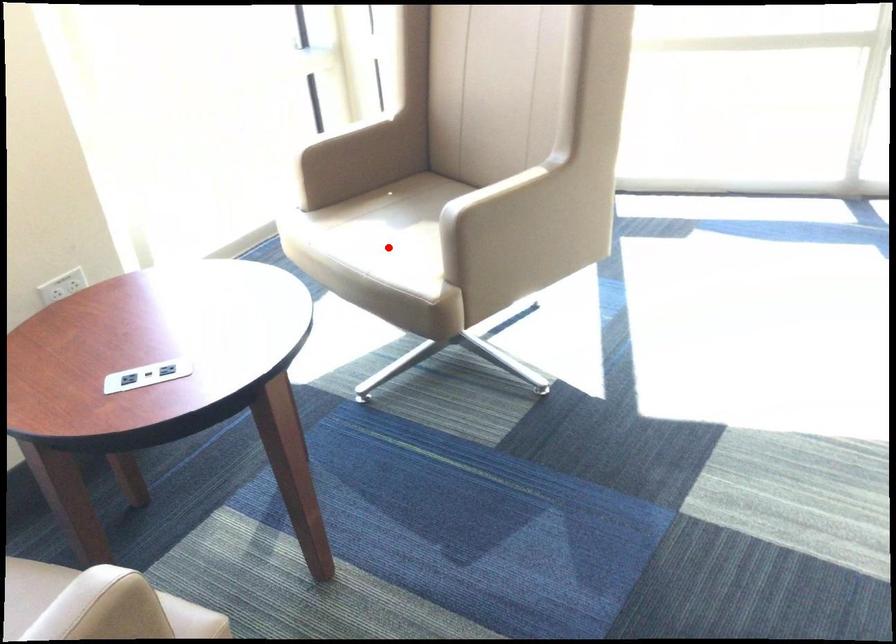
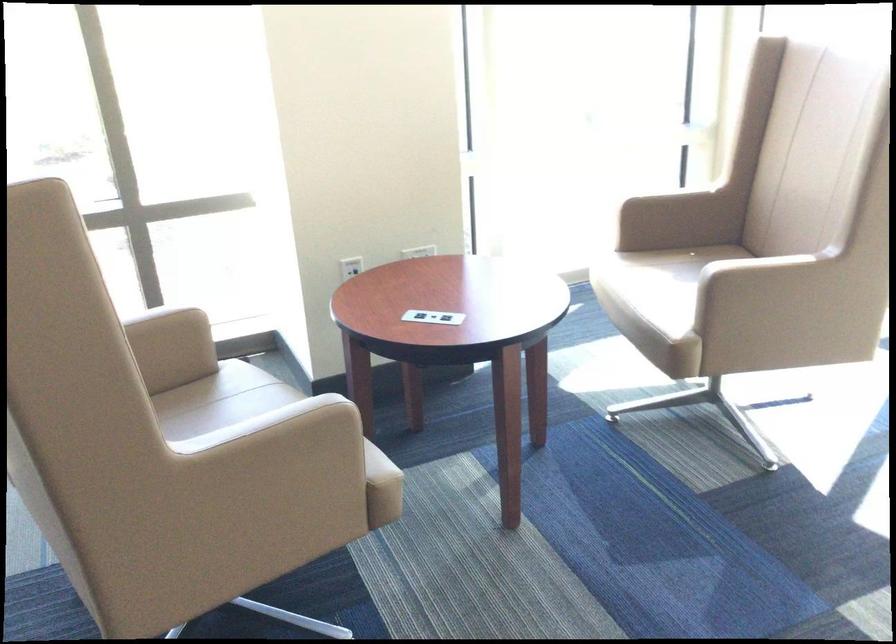
Locate, in the second image, the point that corresponds to the highlighted location in the first image.

(658, 289)